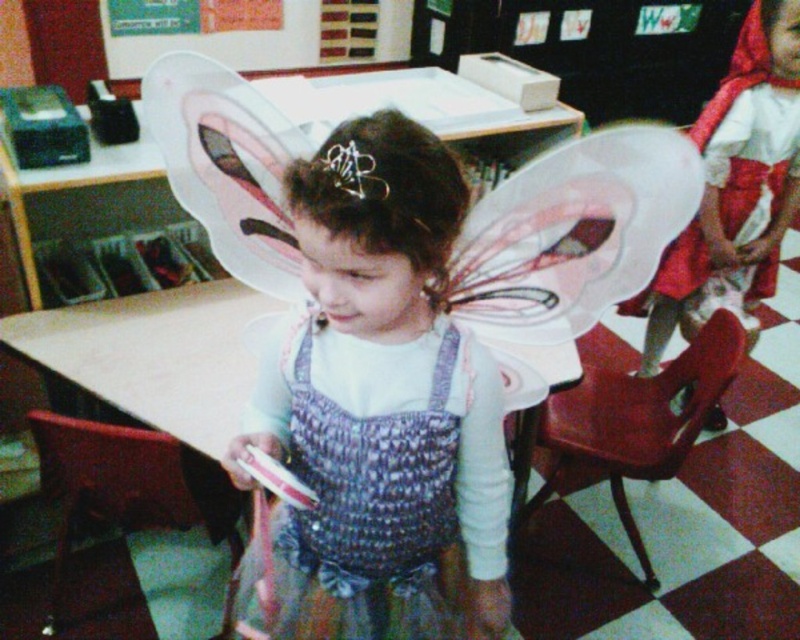
Which of these two, matte pink wings at center or silver metallic tiara at center, stands shorter?

silver metallic tiara at center

What do you see at coordinates (381, 413) in the screenshot?
I see `matte pink wings at center` at bounding box center [381, 413].

Measure the distance between matte pink wings at center and camera.

They are 27.42 inches apart.

The height and width of the screenshot is (640, 800). Identify the location of matte pink wings at center. (381, 413).

Between point (429, 598) and point (733, 172), which one is positioned in front?

Positioned in front is point (429, 598).

Measure the distance between matte pink wings at center and camera.

A distance of 27.42 inches exists between matte pink wings at center and camera.

At what (x,y) coordinates should I click in order to perform the action: click on matte pink wings at center. Please return your answer as a coordinate pair (x, y). This screenshot has width=800, height=640. Looking at the image, I should click on (381, 413).

Which is in front, point (670, 266) or point (342, 160)?

Point (342, 160) is more forward.

Is matte red dress at right bigger than silver metallic tiara at center?

Correct, matte red dress at right is larger in size than silver metallic tiara at center.

Is point (774, 198) farther from viewer compared to point (382, 195)?

Yes, it is.

Identify the location of matte red dress at right. (674, 273).